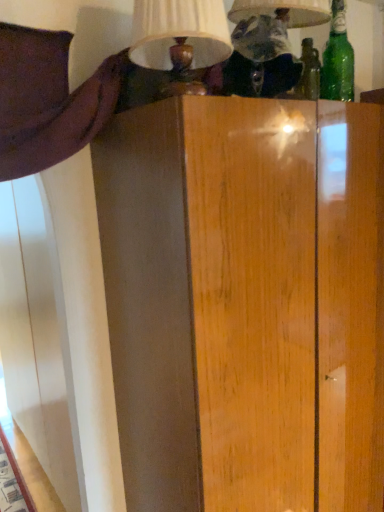
Question: Is matte white lampshade at upper center, positioned as the 2th table lamp in left-to-right order, surrounding green glass bottle at upper right?

Choices:
 (A) no
 (B) yes

Answer: (A)

Question: Is matte white lampshade at upper center, positioned as the 2th table lamp in left-to-right order, further to camera compared to green glass bottle at upper right?

Choices:
 (A) no
 (B) yes

Answer: (A)

Question: Does matte white lampshade at upper center, placed as the first table lamp when sorted from right to left, have a lesser width compared to green glass bottle at upper right?

Choices:
 (A) no
 (B) yes

Answer: (A)

Question: From the image's perspective, is matte white lampshade at upper center, positioned as the 2th table lamp in left-to-right order, located beneath green glass bottle at upper right?

Choices:
 (A) no
 (B) yes

Answer: (B)

Question: Is matte white lampshade at upper center, positioned as the 2th table lamp in left-to-right order, shorter than green glass bottle at upper right?

Choices:
 (A) yes
 (B) no

Answer: (B)

Question: Does matte white lampshade at upper center, placed as the first table lamp when sorted from right to left, appear on the left side of green glass bottle at upper right?

Choices:
 (A) no
 (B) yes

Answer: (B)

Question: From the image's perspective, does green glass bottle at upper right appear higher than matte white lampshade at upper center, placed as the first table lamp when sorted from right to left?

Choices:
 (A) no
 (B) yes

Answer: (B)

Question: From a real-world perspective, is green glass bottle at upper right physically above matte white lampshade at upper center, placed as the first table lamp when sorted from right to left?

Choices:
 (A) no
 (B) yes

Answer: (A)

Question: Is green glass bottle at upper right facing away from matte white lampshade at upper center, positioned as the 2th table lamp in left-to-right order?

Choices:
 (A) yes
 (B) no

Answer: (B)

Question: Is green glass bottle at upper right shorter than matte white lampshade at upper center, placed as the first table lamp when sorted from right to left?

Choices:
 (A) no
 (B) yes

Answer: (B)

Question: From a real-world perspective, is green glass bottle at upper right under matte white lampshade at upper center, placed as the first table lamp when sorted from right to left?

Choices:
 (A) yes
 (B) no

Answer: (A)

Question: Does green glass bottle at upper right have a greater width compared to matte white lampshade at upper center, placed as the first table lamp when sorted from right to left?

Choices:
 (A) yes
 (B) no

Answer: (B)

Question: Considering the relative sizes of matte white lampshade at upper center, placed as the first table lamp when sorted from right to left, and matte cream lampshade at upper center, marked as the 1th table lamp in a left-to-right arrangement, in the image provided, is matte white lampshade at upper center, placed as the first table lamp when sorted from right to left, smaller than matte cream lampshade at upper center, marked as the 1th table lamp in a left-to-right arrangement,?

Choices:
 (A) no
 (B) yes

Answer: (A)